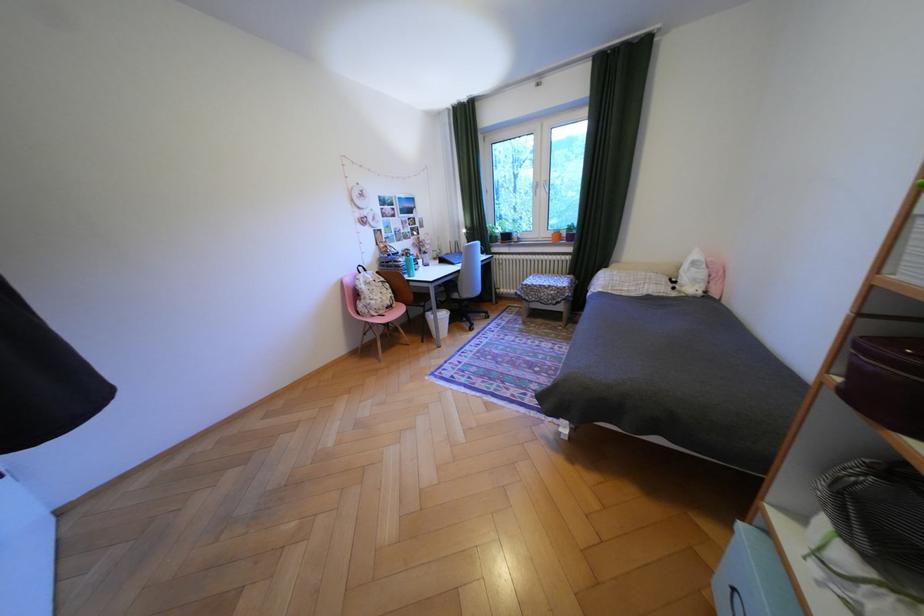
Where is `white window handle`? Image resolution: width=924 pixels, height=616 pixels. white window handle is located at coordinates (543, 187).